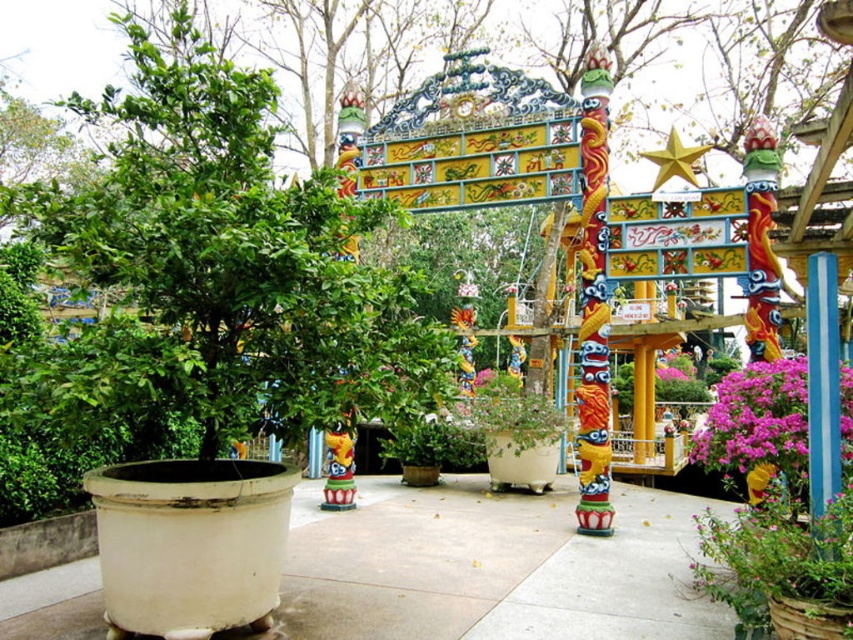
Is purple matte flowers at center right bigger than purple matte flower at center?

No.

Does point (714, 460) come closer to viewer compared to point (337, 465)?

Yes, it is in front of point (337, 465).

Which is in front, point (781, 369) or point (335, 449)?

Point (781, 369) is in front.

Find the location of a particular element. Image resolution: width=853 pixels, height=640 pixels. purple matte flowers at center right is located at coordinates (756, 420).

This screenshot has width=853, height=640. Identify the location of green matte tree at center. (231, 257).

Is green matte tree at center to the right of purple matte flower at center from the viewer's perspective?

Incorrect, green matte tree at center is not on the right side of purple matte flower at center.

This screenshot has height=640, width=853. Describe the element at coordinates (231, 257) in the screenshot. I see `green matte tree at center` at that location.

This screenshot has width=853, height=640. What are the coordinates of `green matte tree at center` in the screenshot? It's located at (231, 257).

Consider the image. Is the position of green matte tree at center less distant than that of white concrete pavement at center?

Yes, it is.

Identify the location of green matte tree at center. (231, 257).